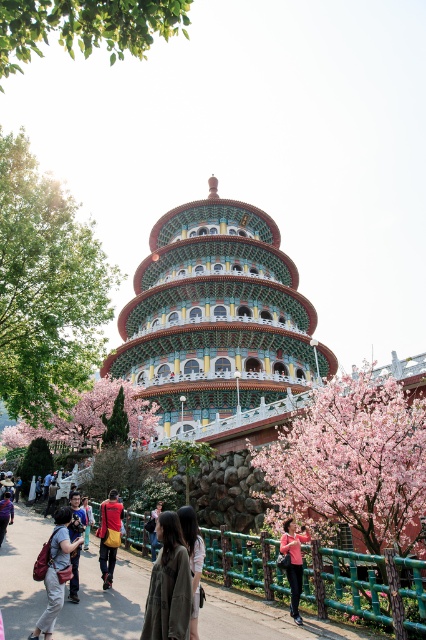
You are a photographer standing at the base of the pagoda, and you want to take a photo of the dark gray fabric jacket at lower center. The camera you are using has a maximum focus range of 20 meters. Will you be able to focus on the jacket?

The dark gray fabric jacket at lower center is 22.30 meters away from camera, which is beyond the camera maximum focus range of 20 meters. Therefore, the camera cannot focus on the jacket.

You are standing at the entrance of the pagoda and want to take a photo of the pink blossoming tree at center. According to the coordinates provided, where should you position yourself to ensure the tree is centered in your camera frame?

The pink blossoming tree at center is located at coordinates point (353,461), so you should position yourself at those coordinates to center it in your camera frame.

You are standing at the entrance of the pagoda and see two points marked in the scene. The first point is at coordinates point (195,259) and the second is at point (104,435). Which point is closer to you?

Point (195,259) is further to the camera than point (104,435), so the point closer to you is point (104,435).